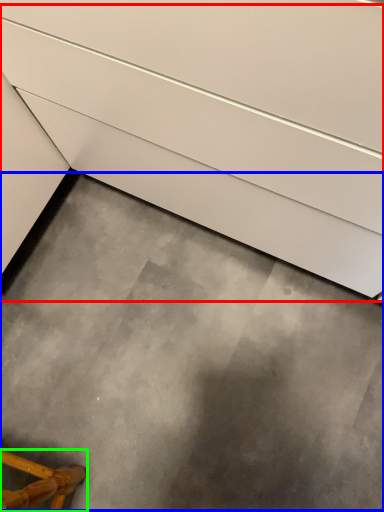
Question: Based on their relative distances, which object is farther from stairs (highlighted by a red box)? Choose from concrete (highlighted by a blue box) and furniture (highlighted by a green box).

Choices:
 (A) concrete
 (B) furniture

Answer: (B)